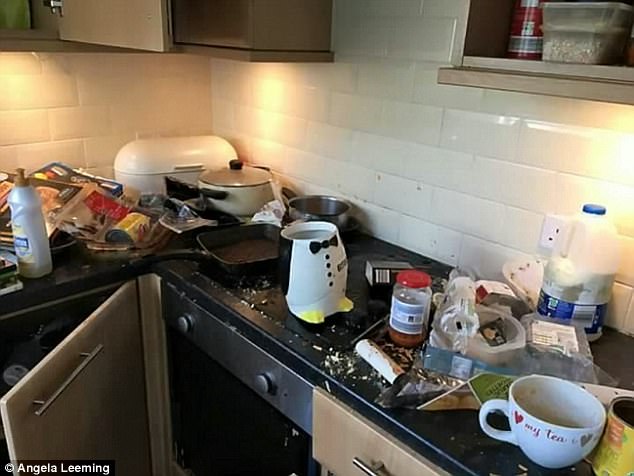
The width and height of the screenshot is (634, 476). I want to click on cabinet drawer, so click(356, 449).